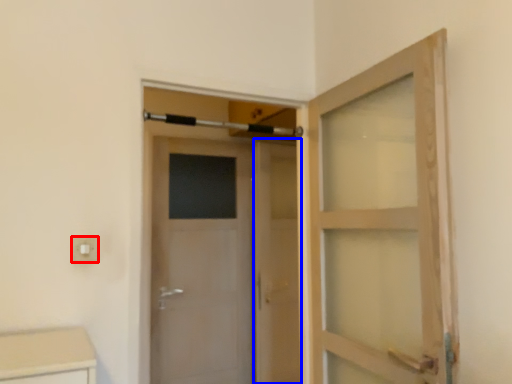
Question: Which point is closer to the camera, electric outlet (highlighted by a red box) or screen door (highlighted by a blue box)?

Choices:
 (A) electric outlet
 (B) screen door

Answer: (A)